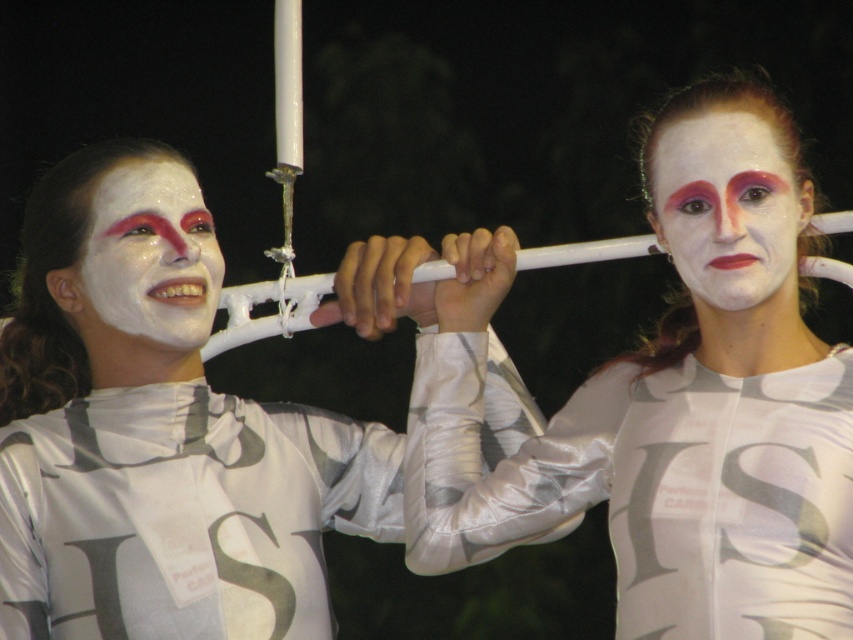
Question: Which point appears closest to the camera in this image?

Choices:
 (A) (682, 196)
 (B) (61, 513)

Answer: (A)

Question: Among these objects, which one is nearest to the camera?

Choices:
 (A) white matte face at upper right
 (B) white satin costume at upper center

Answer: (A)

Question: Can you confirm if white satin/velvet mask at center is thinner than white satin costume at upper center?

Choices:
 (A) no
 (B) yes

Answer: (B)

Question: Does white satin/velvet mask at center appear on the right side of white matte face at upper right?

Choices:
 (A) no
 (B) yes

Answer: (A)

Question: Among these points, which one is nearest to the camera?

Choices:
 (A) pos(24,378)
 (B) pos(135,326)
 (C) pos(659,236)

Answer: (C)

Question: Does white matte face at upper right appear over white matte face at left?

Choices:
 (A) yes
 (B) no

Answer: (A)